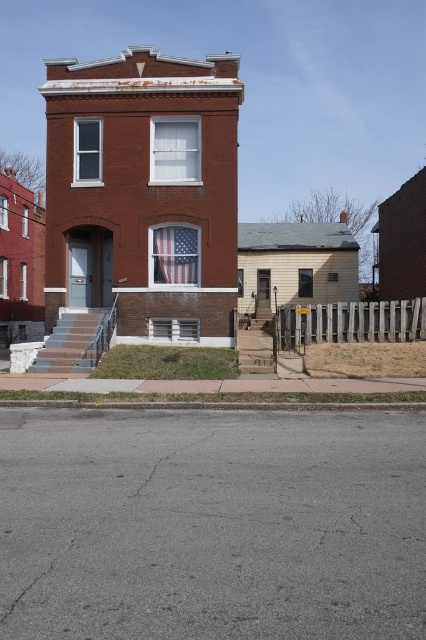
Does gray concrete curb at lower center appear on the left side of american flag at center?

In fact, gray concrete curb at lower center is to the right of american flag at center.

Is point (339, 404) less distant than point (172, 278)?

Yes, point (339, 404) is in front of point (172, 278).

Identify the location of gray concrete curb at lower center. The height and width of the screenshot is (640, 426). [x=215, y=404].